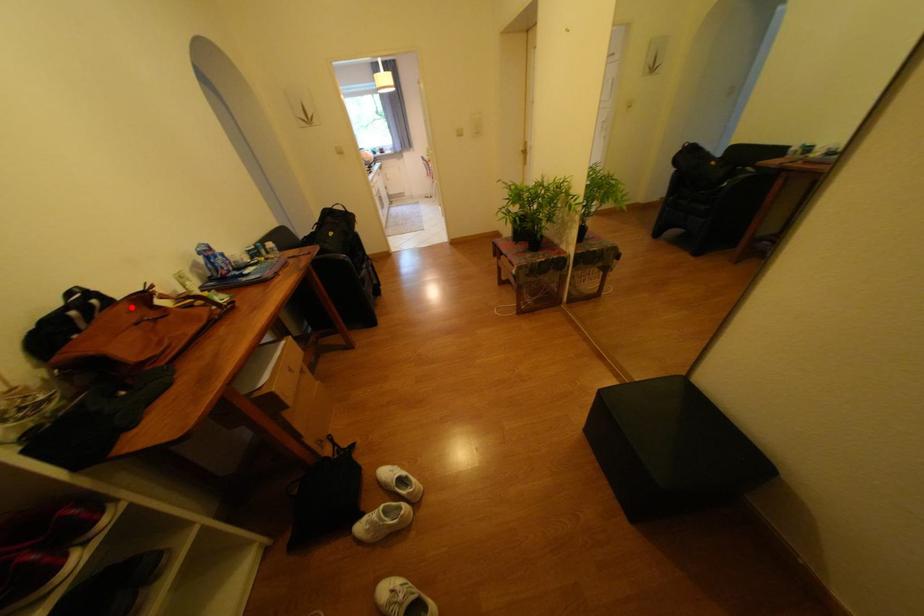
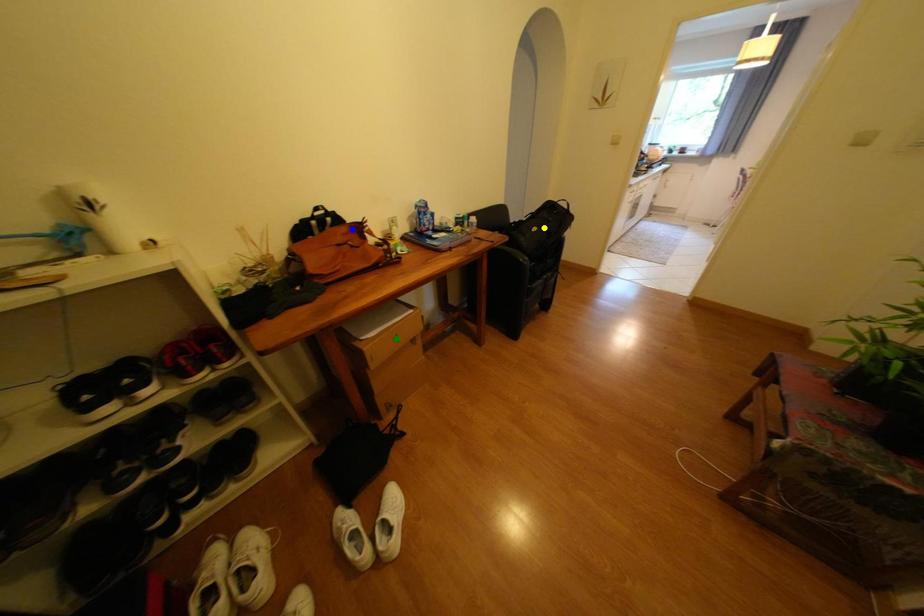
Question: I am providing you with two images of the same scene from different viewpoints. A red point is marked on the first image. You are given multiple points on the second image. In image 2, which mark is for the same physical point as the one in image 1?

Choices:
 (A) yellow point
 (B) green point
 (C) blue point

Answer: (C)